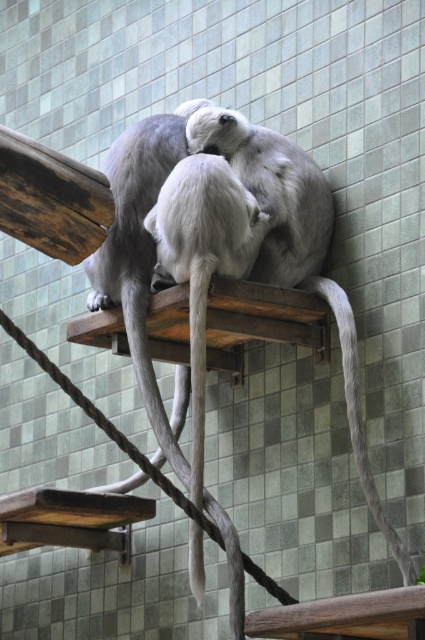
In the scene shown: You are standing at the point marked as point (141, 333). You want to reach the bananas hanging 7.86 meters away from you. Can you safely jump to grab them?

The bananas are 7.86 meters away from point (141, 333). Since the average human jump distance is about 2 meters, you cannot safely jump that far to grab the bananas.